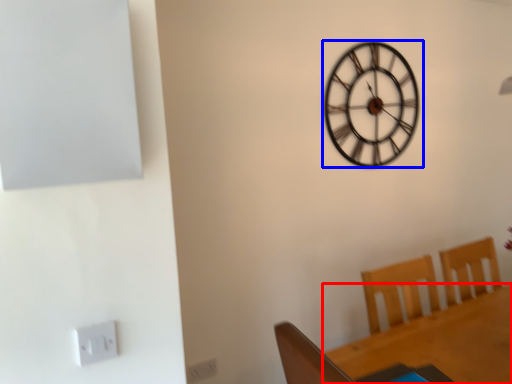
Question: Which of the following is the closest to the observer, round table (highlighted by a red box) or wall clock (highlighted by a blue box)?

Choices:
 (A) round table
 (B) wall clock

Answer: (A)